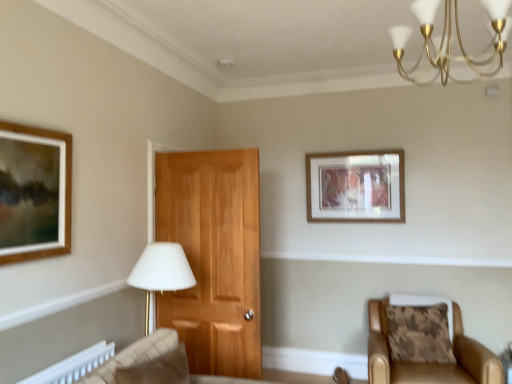
The image size is (512, 384). I want to click on brown textured pillow at lower right, so click(x=419, y=333).

The height and width of the screenshot is (384, 512). In order to click on leather armchair at lower right in this screenshot , I will do `click(428, 363)`.

From the image's perspective, between leather armchair at lower right and brown textured pillow at lower right, which one is located above?

brown textured pillow at lower right is shown above in the image.

In the scene shown: Is leather armchair at lower right to the right of brown textured pillow at lower right from the viewer's perspective?

In fact, leather armchair at lower right is to the left of brown textured pillow at lower right.

Is leather armchair at lower right aimed at brown textured pillow at lower right?

Yes, leather armchair at lower right is oriented towards brown textured pillow at lower right.

Is brown textured pillow at lower right surrounded by leather armchair at lower right?

Yes, brown textured pillow at lower right is a part of leather armchair at lower right.

Is brown textured pillow at lower right oriented away from gold metallic chandelier at upper right?

No.

Considering the relative sizes of brown textured pillow at lower right and gold metallic chandelier at upper right in the image provided, is brown textured pillow at lower right wider than gold metallic chandelier at upper right?

Incorrect, the width of brown textured pillow at lower right does not surpass that of gold metallic chandelier at upper right.

Between brown textured pillow at lower right and gold metallic chandelier at upper right, which one has more height?

brown textured pillow at lower right.

Find the location of a particular element. The height and width of the screenshot is (384, 512). picture frame behind the leather armchair at lower right is located at coordinates (356, 186).

Is leather armchair at lower right positioned beyond the bounds of wooden picture frame at upper center?

leather armchair at lower right is positioned outside wooden picture frame at upper center.

Consider the image. Between leather armchair at lower right and gold metallic chandelier at upper right, which one has less height?

gold metallic chandelier at upper right is shorter.

Is leather armchair at lower right spatially inside gold metallic chandelier at upper right, or outside of it?

leather armchair at lower right is located beyond the bounds of gold metallic chandelier at upper right.

Is leather armchair at lower right far from gold metallic chandelier at upper right?

leather armchair at lower right is far away from gold metallic chandelier at upper right.

Between brown textured pillow at lower right and leather armchair at lower right, which one has less height?

brown textured pillow at lower right.

Does brown textured pillow at lower right have a larger size compared to leather armchair at lower right?

Incorrect, brown textured pillow at lower right is not larger than leather armchair at lower right.

From the image's perspective, is brown textured pillow at lower right above leather armchair at lower right?

Indeed, from the image's perspective, brown textured pillow at lower right is shown above leather armchair at lower right.

From a real-world perspective, who is located lower, brown textured pillow at lower right or wooden picture frame at upper center?

From a 3D spatial view, brown textured pillow at lower right is below.

From the image's perspective, who appears lower, brown textured pillow at lower right or wooden picture frame at upper center?

brown textured pillow at lower right is shown below in the image.

How many degrees apart are the facing directions of brown textured pillow at lower right and wooden picture frame at upper center?

The facing directions of brown textured pillow at lower right and wooden picture frame at upper center are 6.12 degrees apart.

Which object is further away from the camera, brown textured pillow at lower right or wooden picture frame at upper center?

wooden picture frame at upper center is further from the camera.

Locate an element on the screen. This screenshot has width=512, height=384. picture frame that appears behind the brown textured pillow at lower right is located at coordinates (356, 186).

Could you tell me if wooden picture frame at upper center is turned towards brown textured pillow at lower right?

No, wooden picture frame at upper center is not oriented towards brown textured pillow at lower right.

In the scene shown: Which object is further away from the camera taking this photo, wooden picture frame at upper center or brown textured pillow at lower right?

wooden picture frame at upper center is behind.

Considering the sizes of objects wooden picture frame at upper center and brown textured pillow at lower right in the image provided, who is thinner, wooden picture frame at upper center or brown textured pillow at lower right?

With smaller width is wooden picture frame at upper center.

You are a GUI agent. You are given a task and a screenshot of the screen. Output one action in this format:
    pyautogui.click(x=<x>, y=<y>)
    Task: Click on the pillow above the leather armchair at lower right (from the image's perspective)
    This screenshot has height=384, width=512.
    Given the screenshot: What is the action you would take?
    pyautogui.click(x=419, y=333)

Image resolution: width=512 pixels, height=384 pixels. I want to click on pillow located underneath the gold metallic chandelier at upper right (from a real-world perspective), so click(419, 333).

When comparing their distances from wooden picture frame at upper center, does brown textured pillow at lower right or gold metallic chandelier at upper right seem closer?

brown textured pillow at lower right is positioned closer to the anchor wooden picture frame at upper center.

Based on their spatial positions, is wooden picture frame at upper center or gold metallic chandelier at upper right further from brown textured pillow at lower right?

gold metallic chandelier at upper right.

From the image, which object appears to be nearer to leather armchair at lower right, brown textured pillow at lower right or wooden picture frame at upper center?

brown textured pillow at lower right.

When comparing their distances from gold metallic chandelier at upper right, does brown textured pillow at lower right or leather armchair at lower right seem further?

brown textured pillow at lower right.

Estimate the real-world distances between objects in this image. Which object is further from leather armchair at lower right, brown textured pillow at lower right or gold metallic chandelier at upper right?

Among the two, gold metallic chandelier at upper right is located further to leather armchair at lower right.

Considering their positions, is gold metallic chandelier at upper right positioned further to wooden picture frame at upper center than brown textured pillow at lower right?

Based on the image, gold metallic chandelier at upper right appears to be further to wooden picture frame at upper center.

In the scene shown: Estimate the real-world distances between objects in this image. Which object is closer to gold metallic chandelier at upper right, wooden picture frame at upper center or leather armchair at lower right?

wooden picture frame at upper center.

From the image, which object appears to be nearer to gold metallic chandelier at upper right, brown textured pillow at lower right or wooden picture frame at upper center?

Among the two, wooden picture frame at upper center is located nearer to gold metallic chandelier at upper right.

The width and height of the screenshot is (512, 384). I want to click on pillow between gold metallic chandelier at upper right and leather armchair at lower right vertically, so click(x=419, y=333).

Locate an element on the screen. The height and width of the screenshot is (384, 512). pillow between gold metallic chandelier at upper right and wooden picture frame at upper center in the front-back direction is located at coordinates (419, 333).

The width and height of the screenshot is (512, 384). In order to click on chair between gold metallic chandelier at upper right and wooden picture frame at upper center in the front-back direction in this screenshot , I will do `click(428, 363)`.

This screenshot has width=512, height=384. Find the location of `pillow between wooden picture frame at upper center and leather armchair at lower right vertically`. pillow between wooden picture frame at upper center and leather armchair at lower right vertically is located at coordinates (419, 333).